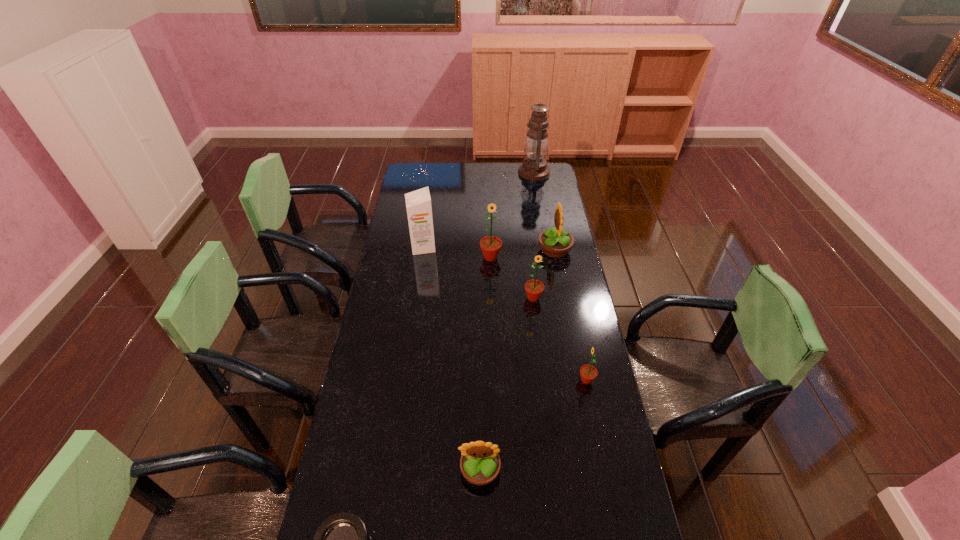
I want to click on the seventh farthest object, so click(x=480, y=463).

This screenshot has height=540, width=960. In order to click on the sixth farthest object in this screenshot , I will do `click(588, 373)`.

Locate an element on the screen. Image resolution: width=960 pixels, height=540 pixels. the rightmost green sunflower is located at coordinates (588, 373).

Locate an element on the screen. This screenshot has height=540, width=960. free location located on the left of the oil lamp is located at coordinates (483, 173).

Where is `vacant space located 0.340m on the face of the leftmost green sunflower`? The height and width of the screenshot is (540, 960). vacant space located 0.340m on the face of the leftmost green sunflower is located at coordinates (492, 324).

You are a GUI agent. You are given a task and a screenshot of the screen. Output one action in this format:
    pyautogui.click(x=<x>, y=<y>)
    Task: Click on the vacant space located on the right of the carton
    This screenshot has height=540, width=960.
    Given the screenshot: What is the action you would take?
    pyautogui.click(x=482, y=247)

Where is `vacant space positioned on the face of the right yellow sunflower`? vacant space positioned on the face of the right yellow sunflower is located at coordinates (462, 249).

Identify the location of free spot located on the face of the right yellow sunflower. The image size is (960, 540). (474, 249).

The image size is (960, 540). I want to click on free spot located on the face of the right yellow sunflower, so click(522, 249).

Where is `free location located 0.260m on the face of the fourth nearest object`? This screenshot has height=540, width=960. free location located 0.260m on the face of the fourth nearest object is located at coordinates (540, 358).